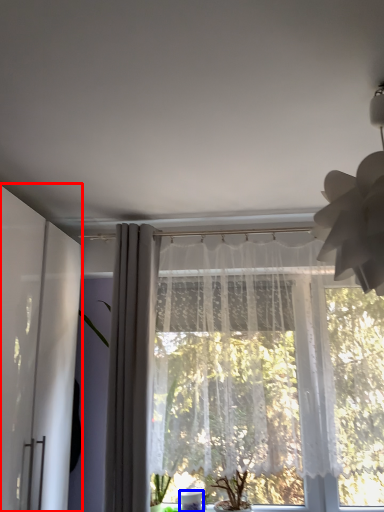
Question: Which of the following is the closest to the observer, screen door (highlighted by a red box) or glass vase (highlighted by a blue box)?

Choices:
 (A) screen door
 (B) glass vase

Answer: (A)